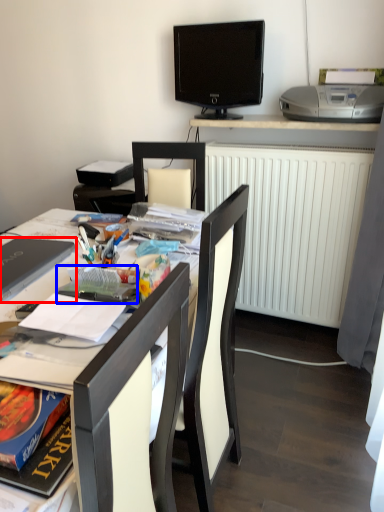
Question: Which point is further to the camera, laptop (highlighted by a red box) or paperback book (highlighted by a blue box)?

Choices:
 (A) laptop
 (B) paperback book

Answer: (A)